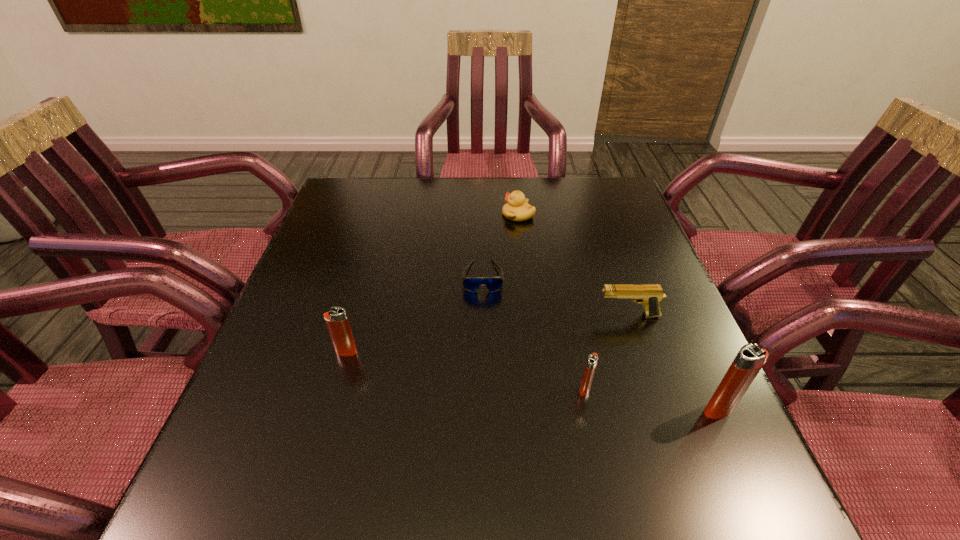
What are the coordinates of `free region located 0.170m at the barrel of the pistol` in the screenshot? It's located at (520, 315).

Locate an element on the screen. The height and width of the screenshot is (540, 960). free location located 0.350m on the front-facing side of the second farthest object is located at coordinates (484, 436).

Where is `object that is positioned at the far edge`? object that is positioned at the far edge is located at coordinates (517, 208).

Where is `object at the near edge`? object at the near edge is located at coordinates (750, 359).

Locate an element on the screen. The image size is (960, 540). object that is positioned at the left edge is located at coordinates (x=337, y=322).

The height and width of the screenshot is (540, 960). I want to click on igniter at the right edge, so click(x=750, y=359).

Where is `pistol that is at the right edge`? This screenshot has height=540, width=960. pistol that is at the right edge is located at coordinates (650, 295).

At what (x,y) coordinates should I click in order to perform the action: click on object positioned at the near right corner. Please return your answer as a coordinate pair (x, y). This screenshot has height=540, width=960. Looking at the image, I should click on (750, 359).

This screenshot has width=960, height=540. In order to click on vacant space at the far edge of the desktop in this screenshot , I will do `click(564, 195)`.

This screenshot has width=960, height=540. I want to click on vacant space at the near edge of the desktop, so click(x=538, y=429).